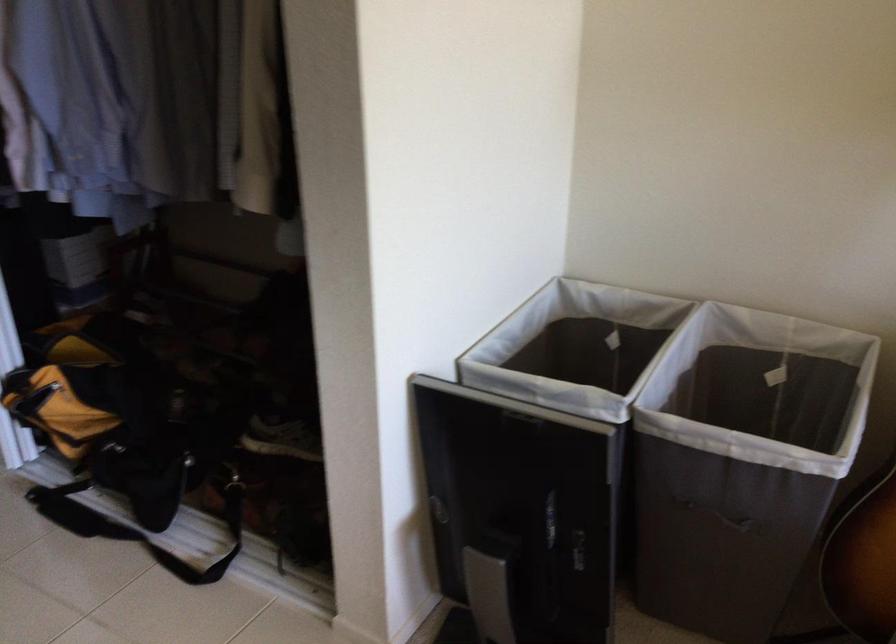
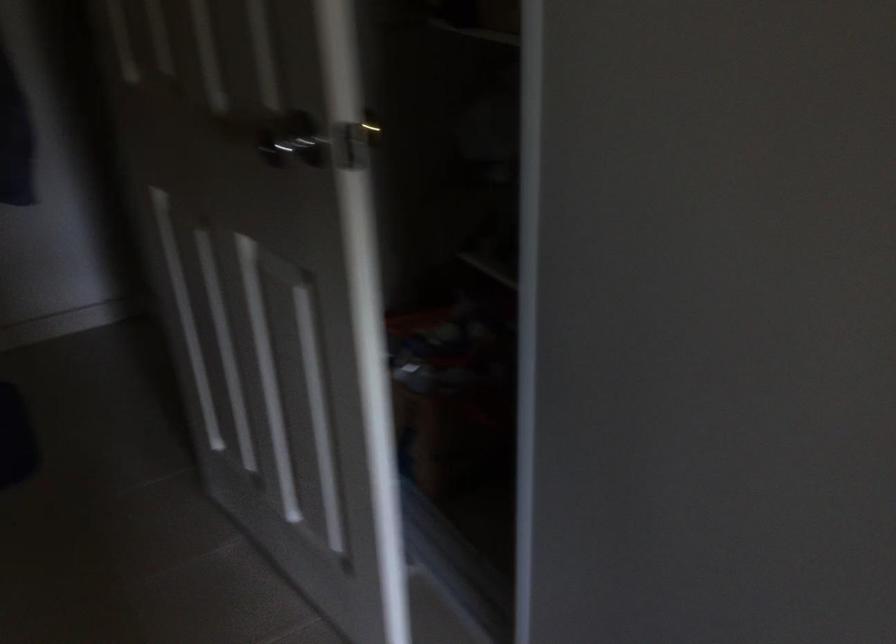
In a continuous first-person perspective shot, in which direction is the camera moving?

The cameraman moved toward left, forward.